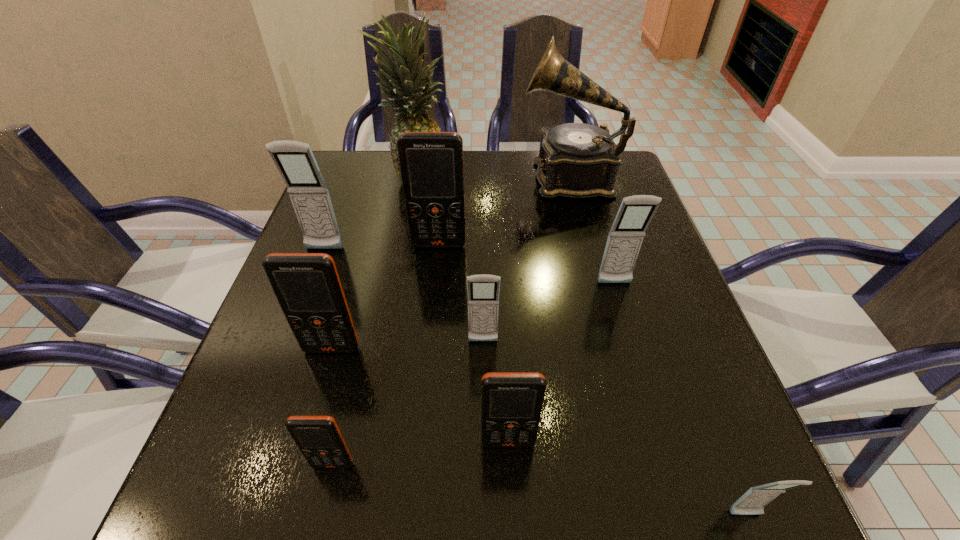
At what (x,y) coordinates should I click in order to perform the action: click on green pineapple. Please return your answer as a coordinate pair (x, y). The image size is (960, 540). Looking at the image, I should click on (409, 88).

Locate an element on the screen. This screenshot has height=540, width=960. phonograph record is located at coordinates (576, 160).

Where is `the fifth cellular telephone from right to left`? The width and height of the screenshot is (960, 540). the fifth cellular telephone from right to left is located at coordinates (431, 163).

Find the location of a particular element. the biggest orange cellular telephone is located at coordinates (431, 163).

The height and width of the screenshot is (540, 960). I want to click on the biggest gray cellular telephone, so click(308, 192).

Find the location of `the leftmost gray cellular telephone`. the leftmost gray cellular telephone is located at coordinates [x=308, y=192].

Find the location of a particular element. The image size is (960, 540). the third farthest cellular telephone is located at coordinates (624, 241).

You are a GUI agent. You are given a task and a screenshot of the screen. Output one action in this format:
    pyautogui.click(x=<x>, y=<y>)
    Task: Click on the third nearest gray cellular telephone
    
    Given the screenshot: What is the action you would take?
    tap(624, 241)

The height and width of the screenshot is (540, 960). What are the coordinates of `the second biggest orange cellular telephone` in the screenshot? It's located at click(x=307, y=286).

Locate an element on the screen. The height and width of the screenshot is (540, 960). the second nearest gray cellular telephone is located at coordinates (483, 290).